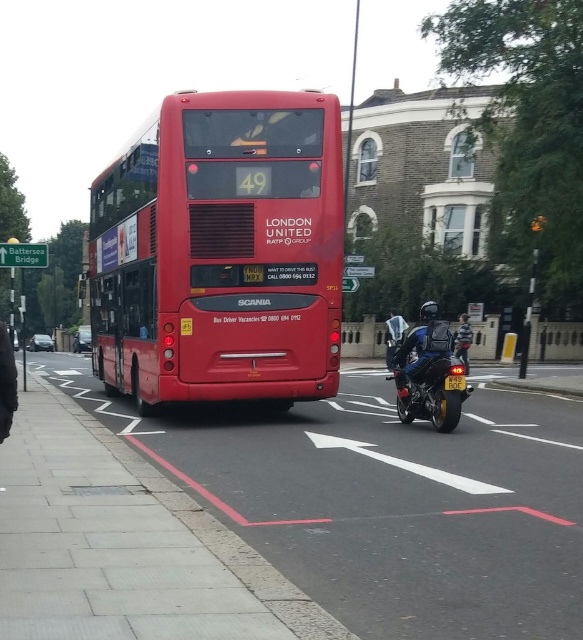
You are a pedestrian standing at the side of the road. You see the matte red bus at center and the shiny blue motorcycle at center. If the distance between them is 5.43 meters, can you safely cross the road between them without getting hit?

The distance between the matte red bus at center and the shiny blue motorcycle at center is 5.43 meters. To safely cross between them, you should ensure that both vehicles are stationary and that there is enough space to pass without obstruction. However, since the motorcycle is described as riding away from the camera, it might still be in motion. Exercise caution and confirm both vehicles are stopped before crossing.

You are standing at the point with coordinates point (114,337) and want to walk to the point with coordinates point (429,356). Which direction should you face to walk towards your destination?

You should face north because point (114,337) is behind point (429,356), so the destination is in front of you when facing north.